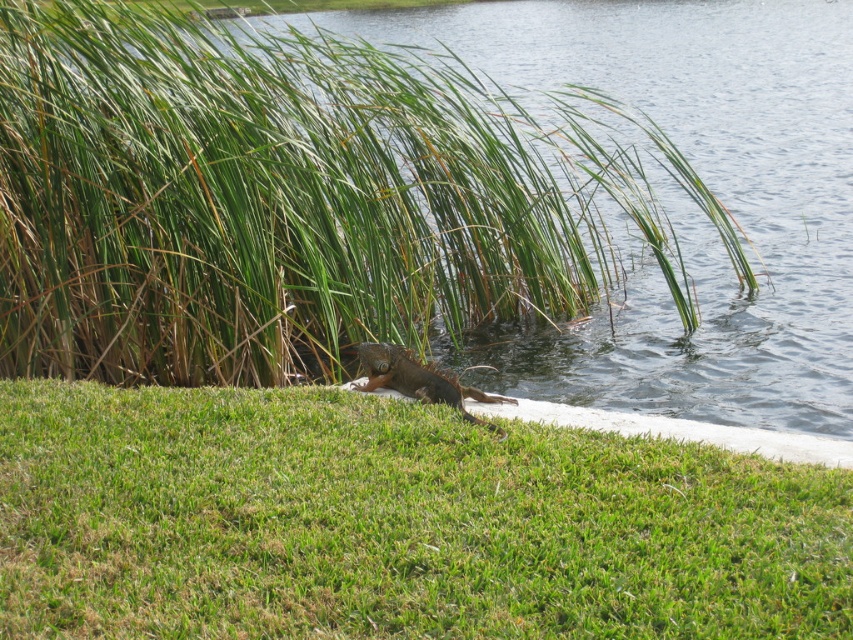
Which of these two, clear water at grass right or brown scaly lizard at center, stands taller?

clear water at grass right

Which is in front, point (810, 378) or point (434, 397)?

Positioned in front is point (434, 397).

At what (x,y) coordinates should I click in order to perform the action: click on clear water at grass right. Please return your answer as a coordinate pair (x, y). Looking at the image, I should click on (430, 198).

The width and height of the screenshot is (853, 640). In order to click on clear water at grass right in this screenshot , I will do `click(430, 198)`.

Between point (83, 310) and point (349, 493), which one is positioned behind?

The point (83, 310) is behind.

Between point (253, 131) and point (167, 396), which one is positioned in front?

Point (167, 396) is more forward.

This screenshot has width=853, height=640. In order to click on clear water at grass right in this screenshot , I will do `click(430, 198)`.

Which is behind, point (248, 508) or point (433, 388)?

Point (433, 388)

Between green grassy at lower center and brown scaly lizard at center, which one appears on the left side from the viewer's perspective?

From the viewer's perspective, green grassy at lower center appears more on the left side.

Does point (120, 504) lie behind point (373, 388)?

No, (120, 504) is in front of (373, 388).

At what (x,y) coordinates should I click in order to perform the action: click on green grassy at lower center. Please return your answer as a coordinate pair (x, y). The width and height of the screenshot is (853, 640). Looking at the image, I should click on (393, 524).